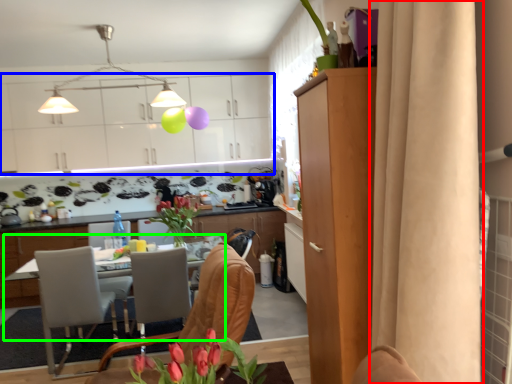
Question: Considering the real-world distances, which object is closest to curtain (highlighted by a red box)? cabinetry (highlighted by a blue box) or desk (highlighted by a green box).

Choices:
 (A) cabinetry
 (B) desk

Answer: (B)